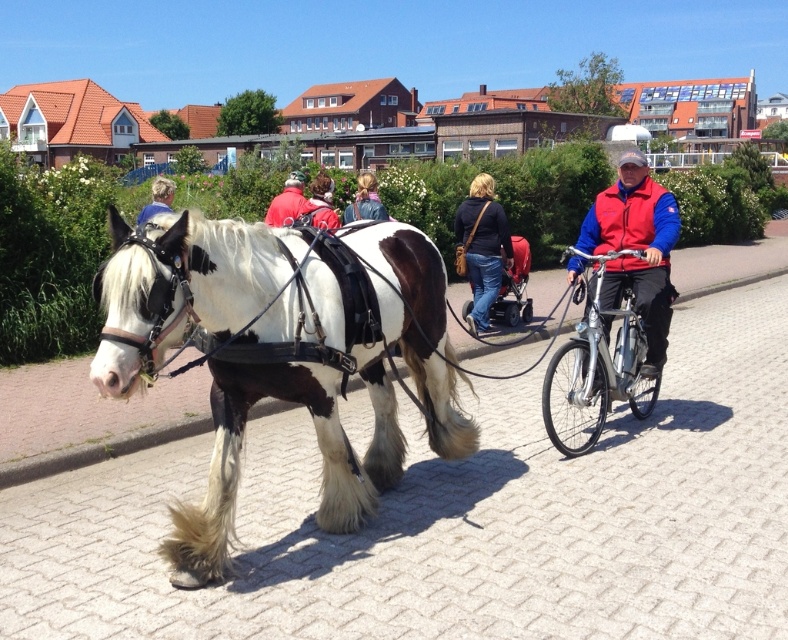
Question: Is red fleece jacket at right positioned at the back of silver metallic bicycle at center?

Choices:
 (A) no
 (B) yes

Answer: (B)

Question: Can you confirm if white and brown speckled horse at left is positioned to the right of blonde hair at upper left?

Choices:
 (A) no
 (B) yes

Answer: (B)

Question: Which of the following is the farthest from the observer?

Choices:
 (A) white and brown speckled horse at left
 (B) red fabric stroller at center
 (C) red fleece jacket at right

Answer: (B)

Question: Which point is closer to the camera?

Choices:
 (A) (281, 193)
 (B) (474, 260)

Answer: (B)

Question: Does white and brown speckled horse at left have a lesser width compared to dark blue sweater at center?

Choices:
 (A) no
 (B) yes

Answer: (A)

Question: Among these objects, which one is nearest to the camera?

Choices:
 (A) blonde hair at upper left
 (B) matte black jacket at center

Answer: (A)